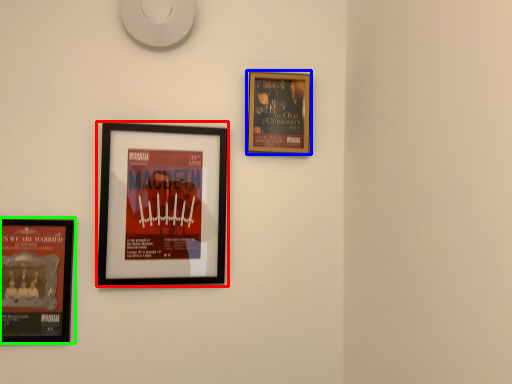
Question: Which object is the farthest from picture frame (highlighted by a red box)? Choose among these: picture frame (highlighted by a blue box) or picture frame (highlighted by a green box).

Choices:
 (A) picture frame
 (B) picture frame

Answer: (A)